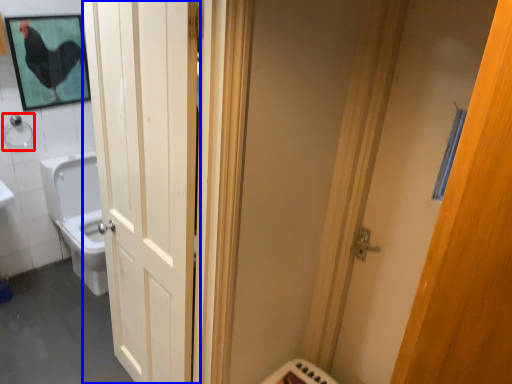
Question: Which object is closer to the camera taking this photo, shower (highlighted by a red box) or door (highlighted by a blue box)?

Choices:
 (A) shower
 (B) door

Answer: (B)